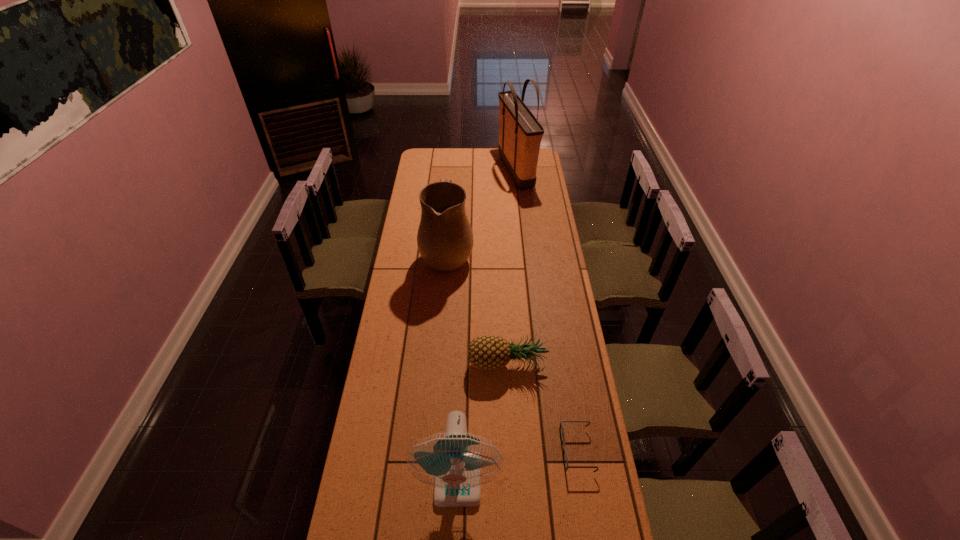
This screenshot has width=960, height=540. Identify the location of vacant space at the left edge. [419, 278].

In the image, there is a desktop. Identify the location of free region at the right edge. (607, 516).

Identify the location of free spot at the far left corner of the desktop. (443, 149).

The image size is (960, 540). I want to click on vacant space at the far right corner of the desktop, so click(543, 164).

Locate an element on the screen. The image size is (960, 540). free point between the fan and the shopping bag is located at coordinates (487, 325).

At what (x,y) coordinates should I click in order to perform the action: click on free spot between the tallest object and the second shortest object. Please return your answer as a coordinate pair (x, y). Looking at the image, I should click on (512, 267).

Locate an element on the screen. This screenshot has width=960, height=540. free space between the third nearest object and the shortest object is located at coordinates (541, 406).

The height and width of the screenshot is (540, 960). What are the coordinates of `free space between the spectacles and the shopping bag` in the screenshot? It's located at click(x=546, y=310).

Where is `free area in between the spectacles and the farthest object`? The height and width of the screenshot is (540, 960). free area in between the spectacles and the farthest object is located at coordinates (546, 310).

At what (x,y) coordinates should I click in order to perform the action: click on vacant space that is in between the fan and the fourth nearest object. Please return your answer as a coordinate pair (x, y). The height and width of the screenshot is (540, 960). Looking at the image, I should click on (453, 366).